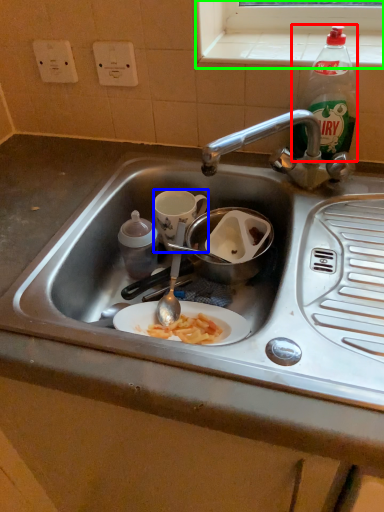
Question: Considering the real-world distances, which object is farthest from bottle (highlighted by a red box)? coffee cup (highlighted by a blue box) or window sill (highlighted by a green box)?

Choices:
 (A) coffee cup
 (B) window sill

Answer: (A)